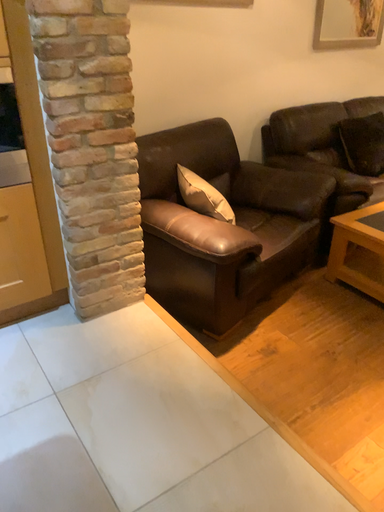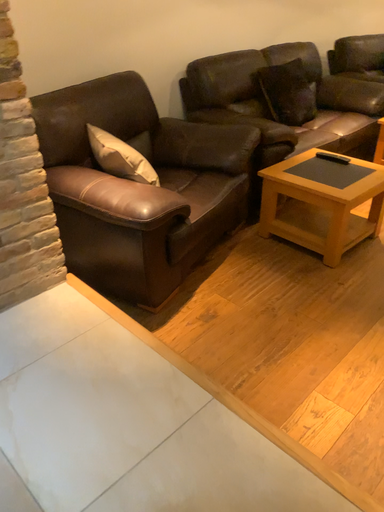
Question: Which way did the camera rotate in the video?

Choices:
 (A) rotated right
 (B) rotated left

Answer: (A)